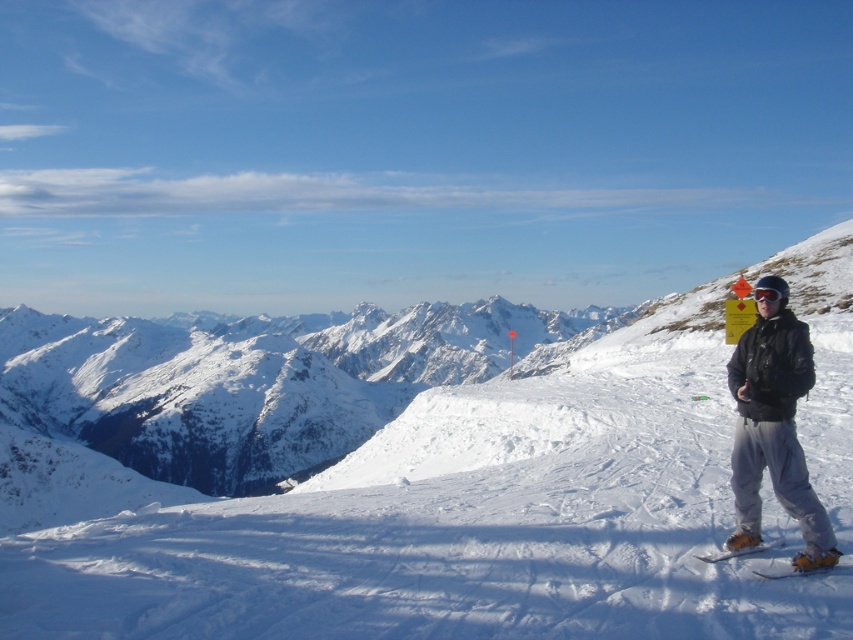
Can you confirm if yellow plastic snowboard at lower right is smaller than black matte goggles at right?

Indeed, yellow plastic snowboard at lower right has a smaller size compared to black matte goggles at right.

The image size is (853, 640). I want to click on yellow plastic snowboard at lower right, so click(x=740, y=550).

Can you confirm if white powdery snow at center is smaller than black matte goggles at right?

No, white powdery snow at center is not smaller than black matte goggles at right.

Does white powdery snow at center appear under black matte goggles at right?

Yes.

Where is `white powdery snow at center`? Image resolution: width=853 pixels, height=640 pixels. white powdery snow at center is located at coordinates (456, 524).

Describe the element at coordinates (805, 564) in the screenshot. I see `yellow matte snowboard at lower right` at that location.

Locate an element on the screen. yellow matte snowboard at lower right is located at coordinates (805, 564).